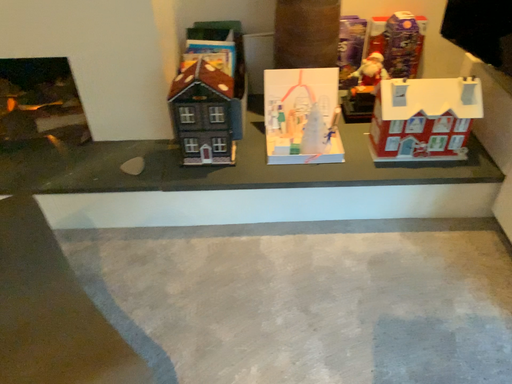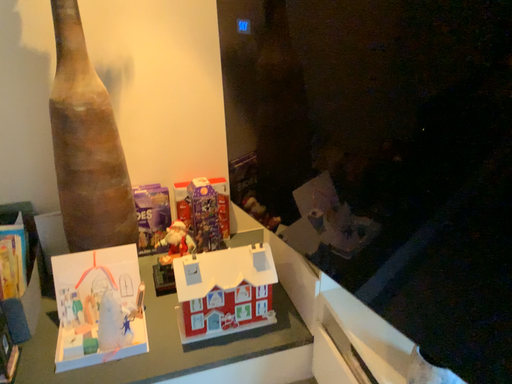
Question: How did the camera likely rotate when shooting the video?

Choices:
 (A) rotated downward
 (B) rotated upward

Answer: (B)